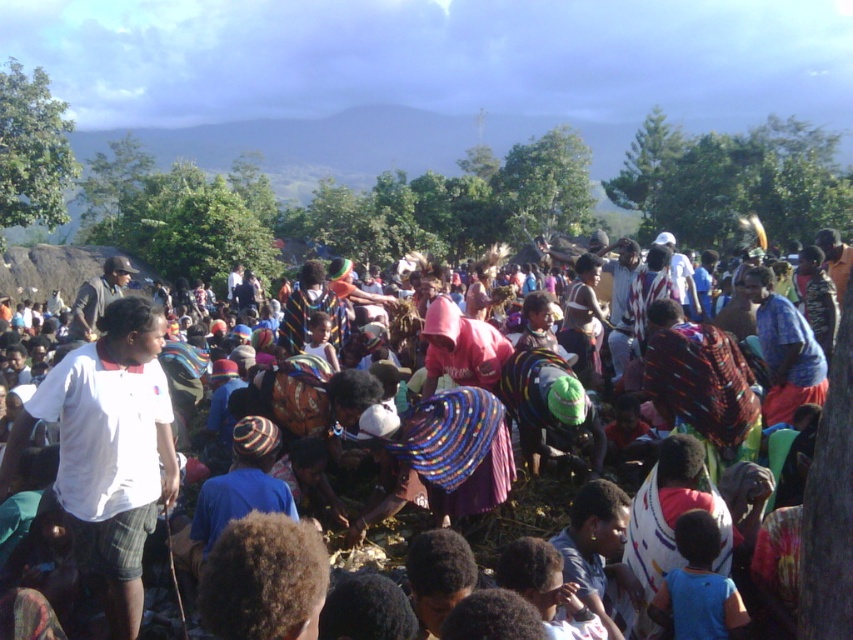
Between white cotton shirt at center and multicolored woven fabric at center, which one appears on the left side from the viewer's perspective?

white cotton shirt at center is more to the left.

The image size is (853, 640). What do you see at coordinates (108, 451) in the screenshot?
I see `white cotton shirt at center` at bounding box center [108, 451].

Between point (112, 568) and point (824, 636), which one is positioned in front?

Point (824, 636) is more forward.

You are a GUI agent. You are given a task and a screenshot of the screen. Output one action in this format:
    pyautogui.click(x=<x>, y=<y>)
    Task: Click on the white cotton shirt at center
    
    Given the screenshot: What is the action you would take?
    pyautogui.click(x=108, y=451)